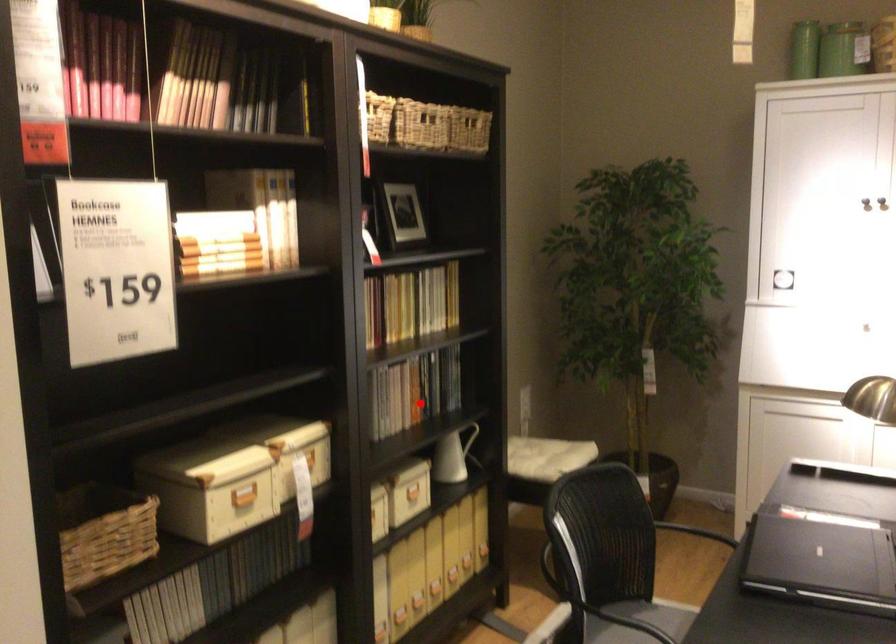
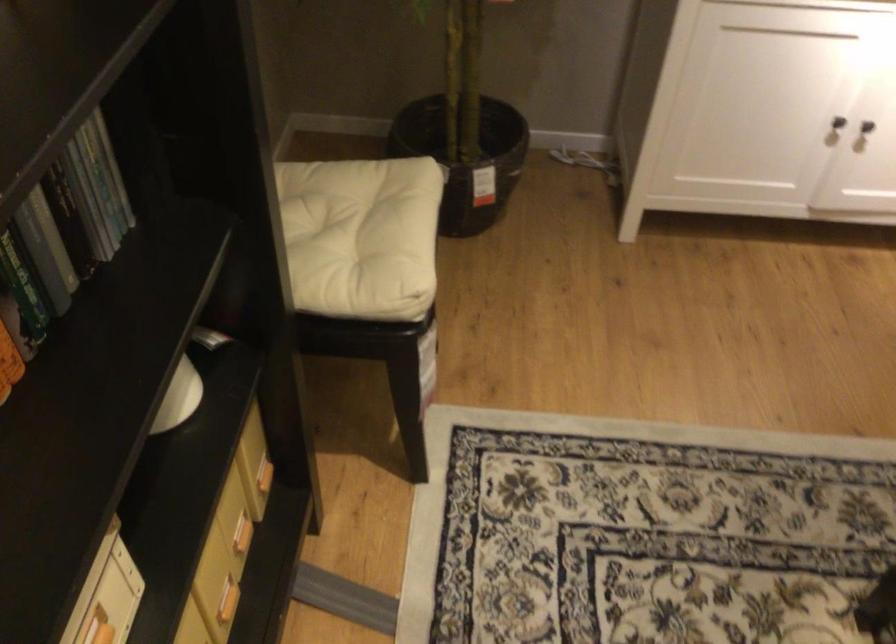
Question: I am providing you with two images of the same scene from different viewpoints. In image1, a red point is highlighted. Considering the same 3D point in image2, which of the following is correct?

Choices:
 (A) It is closer
 (B) It is farther

Answer: (A)